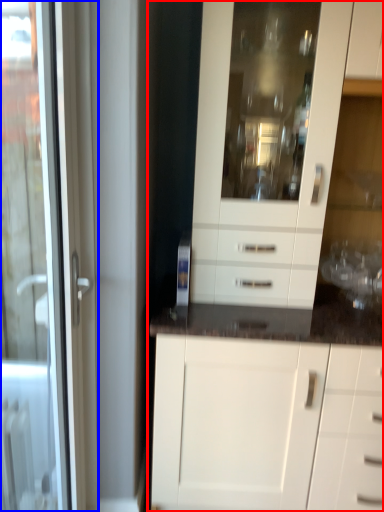
Question: Among these objects, which one is farthest to the camera, cabinetry (highlighted by a red box) or door (highlighted by a blue box)?

Choices:
 (A) cabinetry
 (B) door

Answer: (A)